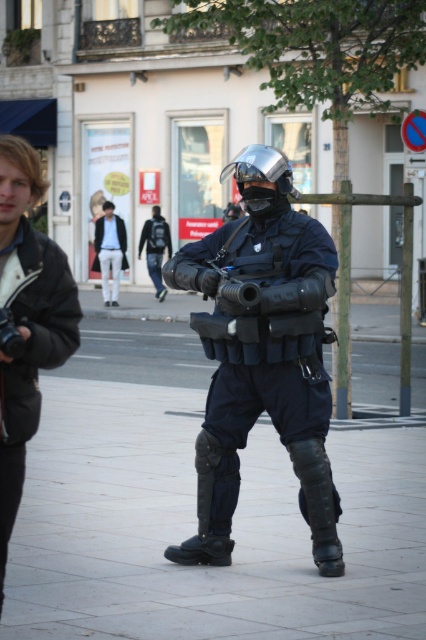
Question: Which point is farther to the camera?

Choices:
 (A) dark blue uniform at center
 (B) black leather boot at center
 (C) matte black tactical gear at center
 (D) black leather jacket at left

Answer: (A)

Question: Can you confirm if black leather jacket at left is smaller than black leather boot at center?

Choices:
 (A) no
 (B) yes

Answer: (A)

Question: Which object appears closest to the camera in this image?

Choices:
 (A) matte black tactical gear at center
 (B) black leather jacket at left
 (C) black leather boot at lower center
 (D) black leather boot at center

Answer: (B)

Question: Is black rubber boots at center wider than matte black tactical gear at center?

Choices:
 (A) no
 (B) yes

Answer: (B)

Question: Among these points, which one is farthest from the camera?

Choices:
 (A) (227, 435)
 (B) (37, 296)

Answer: (A)

Question: Can you confirm if light blue denim jacket at upper left is thinner than dark blue uniform at center?

Choices:
 (A) yes
 (B) no

Answer: (B)